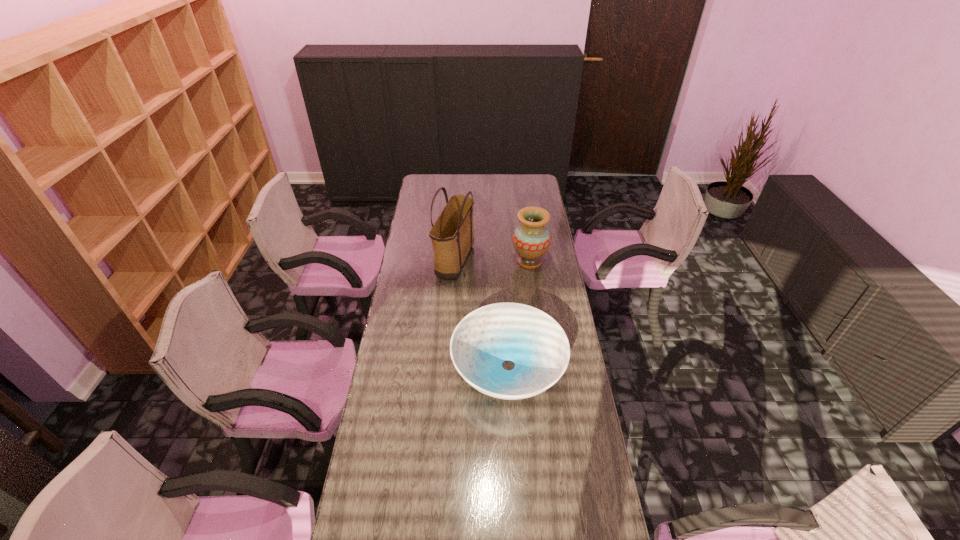
Identify the location of tote bag. This screenshot has width=960, height=540. (452, 237).

You are a GUI agent. You are given a task and a screenshot of the screen. Output one action in this format:
    pyautogui.click(x=<x>, y=<y>)
    Task: Click on the vase
    
    Given the screenshot: What is the action you would take?
    pyautogui.click(x=531, y=239)

The image size is (960, 540). Find the location of `the shortest object`. the shortest object is located at coordinates tap(537, 345).

Locate an element on the screen. the nearest object is located at coordinates (537, 345).

This screenshot has height=540, width=960. What are the coordinates of `vacant position located on the right of the tote bag` in the screenshot? It's located at (553, 262).

Where is `vacant space located on the back of the second shortest object`? This screenshot has width=960, height=540. vacant space located on the back of the second shortest object is located at coordinates (525, 226).

The width and height of the screenshot is (960, 540). Identify the location of blank space located 0.140m on the front of the shortest object. (514, 457).

This screenshot has width=960, height=540. Identify the location of object that is at the left edge. (452, 237).

Find the location of a particular element. Image resolution: width=960 pixels, height=540 pixels. vase situated at the right edge is located at coordinates (531, 239).

In order to click on dish located in the right edge section of the desktop in this screenshot , I will do `click(537, 345)`.